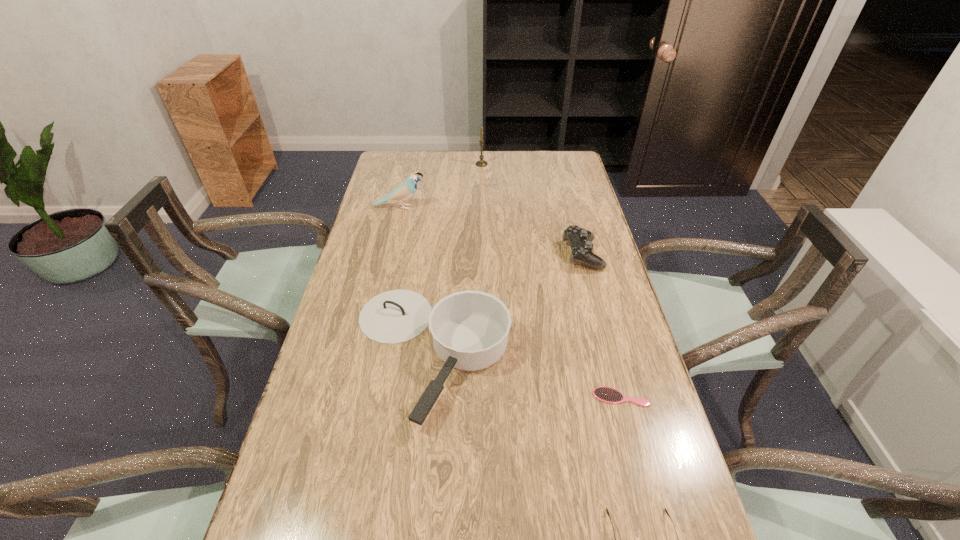
You are a GUI agent. You are given a task and a screenshot of the screen. Output one action in this format:
    pyautogui.click(x=<x>, y=<y>)
    Task: Click on the vacant space that satisfies the following two spatial constraints: 1. at the face of the second farthest object; 2. on the left side of the saucepan
    The height and width of the screenshot is (540, 960).
    Given the screenshot: What is the action you would take?
    pyautogui.click(x=366, y=352)

This screenshot has width=960, height=540. What are the coordinates of `vacant space that satisfies the following two spatial constraints: 1. at the face of the fifth nearest object; 2. on the left side of the fourth tallest object` in the screenshot? It's located at (389, 254).